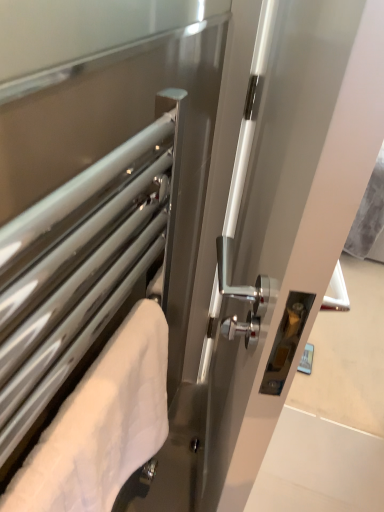
Question: Is satin silver towel rack at left, positioned as the second screen door in right-to-left order, to the right of white fluffy towel at left from the viewer's perspective?

Choices:
 (A) no
 (B) yes

Answer: (A)

Question: Is satin silver towel rack at left, positioned as the second screen door in right-to-left order, aimed at white fluffy towel at left?

Choices:
 (A) yes
 (B) no

Answer: (A)

Question: Is satin silver towel rack at left, the 1th screen door in the left-to-right sequence, smaller than white fluffy towel at left?

Choices:
 (A) yes
 (B) no

Answer: (B)

Question: Are satin silver towel rack at left, positioned as the second screen door in right-to-left order, and white fluffy towel at left far apart?

Choices:
 (A) yes
 (B) no

Answer: (B)

Question: Is satin silver towel rack at left, the 1th screen door in the left-to-right sequence, to the left of white fluffy towel at left from the viewer's perspective?

Choices:
 (A) yes
 (B) no

Answer: (A)

Question: Is white fluffy towel at left at the back of satin silver towel rack at left, positioned as the second screen door in right-to-left order?

Choices:
 (A) yes
 (B) no

Answer: (A)

Question: Is satin silver towel rack at left, the 1th screen door in the left-to-right sequence, in front of white glossy handle at center, the 2th screen door positioned from the left?

Choices:
 (A) no
 (B) yes

Answer: (B)

Question: Is satin silver towel rack at left, positioned as the second screen door in right-to-left order, behind white glossy handle at center, the 2th screen door positioned from the left?

Choices:
 (A) yes
 (B) no

Answer: (B)

Question: Can you confirm if satin silver towel rack at left, the 1th screen door in the left-to-right sequence, is thinner than white glossy handle at center, the 2th screen door positioned from the left?

Choices:
 (A) yes
 (B) no

Answer: (A)

Question: Is satin silver towel rack at left, the 1th screen door in the left-to-right sequence, aimed at white glossy handle at center, which is the 1th screen door in right-to-left order?

Choices:
 (A) yes
 (B) no

Answer: (B)

Question: Does satin silver towel rack at left, the 1th screen door in the left-to-right sequence, have a larger size compared to white glossy handle at center, which is the 1th screen door in right-to-left order?

Choices:
 (A) no
 (B) yes

Answer: (A)

Question: From the image's perspective, is satin silver towel rack at left, the 1th screen door in the left-to-right sequence, under white glossy handle at center, which is the 1th screen door in right-to-left order?

Choices:
 (A) no
 (B) yes

Answer: (B)

Question: Is white glossy handle at center, which is the 1th screen door in right-to-left order, positioned beyond the bounds of satin silver towel rack at left, the 1th screen door in the left-to-right sequence?

Choices:
 (A) yes
 (B) no

Answer: (A)